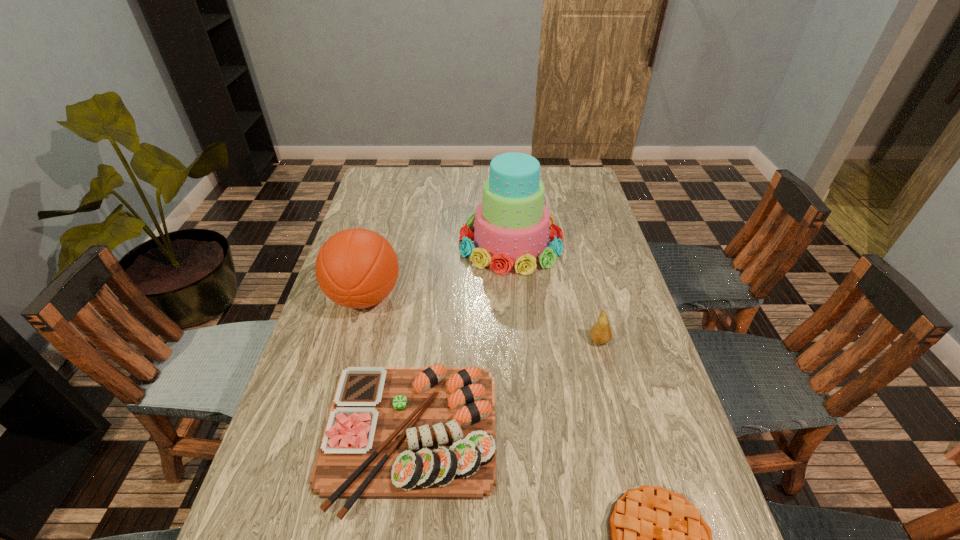
Image resolution: width=960 pixels, height=540 pixels. I want to click on object that is the closest to the cake, so click(x=357, y=268).

Select which object is the second closest to the third tallest object. Please provide its 2D coordinates. Your answer should be formatted as a tuple, i.e. [(x, y)], where the tuple contains the x and y coordinates of a point satisfying the conditions above.

[(392, 432)]